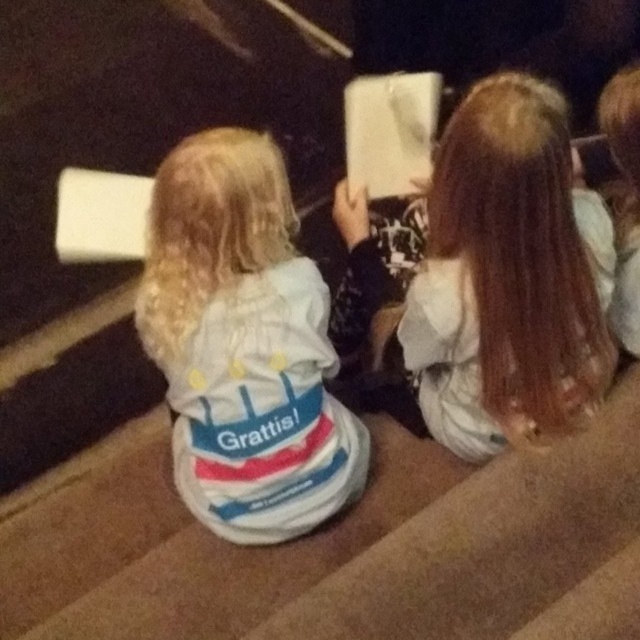
You are a photographer trying to capture a photo of the two children on the stage. You notice the white soft hoodie at center and the smooth brown hair at center. Which object should you focus on if you want to capture the wider one in your shot?

The white soft hoodie at center is wider than the smooth brown hair at center, so you should focus on the white soft hoodie at center to capture the wider object.

You are a photographer trying to capture a candid shot of the two children on the stage. You notice the white soft hoodie at center and the smooth brown hair at center. Which object is positioned lower in the image?

The white soft hoodie at center is located below smooth brown hair at center, so it is positioned lower in the image.

You are standing at a point 1.31 meters away from the camera, which is the point labeled as point (173,264). You want to take a photo of the two children sitting on the stage. Will you be able to capture both children in your photo if your camera has a standard 50mm lens with a 46 degree field of view?

The distance between point (173,264) and the camera is 1.31 meters. With a standard 50mm lens and a 46 degree field of view, the camera can capture a horizontal angle of approximately 46 degrees. To determine if both children are within the frame, we need to know their positions relative to the central point. However, since the exact positions of the children aren...